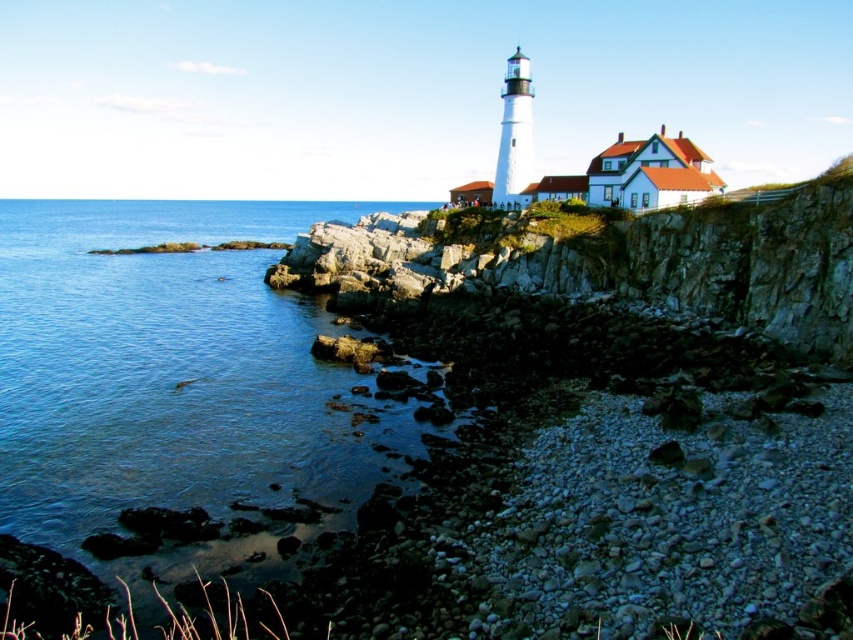
Does blue water at lower left appear under rocky cliff at upper center?

No, blue water at lower left is not below rocky cliff at upper center.

Can you confirm if blue water at lower left is taller than rocky cliff at upper center?

Indeed, blue water at lower left has a greater height compared to rocky cliff at upper center.

Does point (10, 456) come farther from viewer compared to point (762, 253)?

No, (10, 456) is closer to viewer.

At what (x,y) coordinates should I click in order to perform the action: click on blue water at lower left. Please return your answer as a coordinate pair (x, y). This screenshot has width=853, height=640. Looking at the image, I should click on (177, 390).